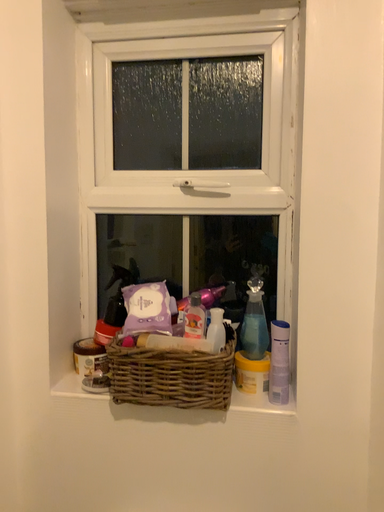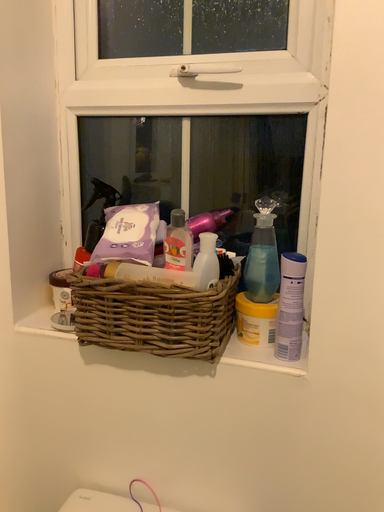
Question: How did the camera likely rotate when shooting the video?

Choices:
 (A) rotated left
 (B) rotated right

Answer: (A)